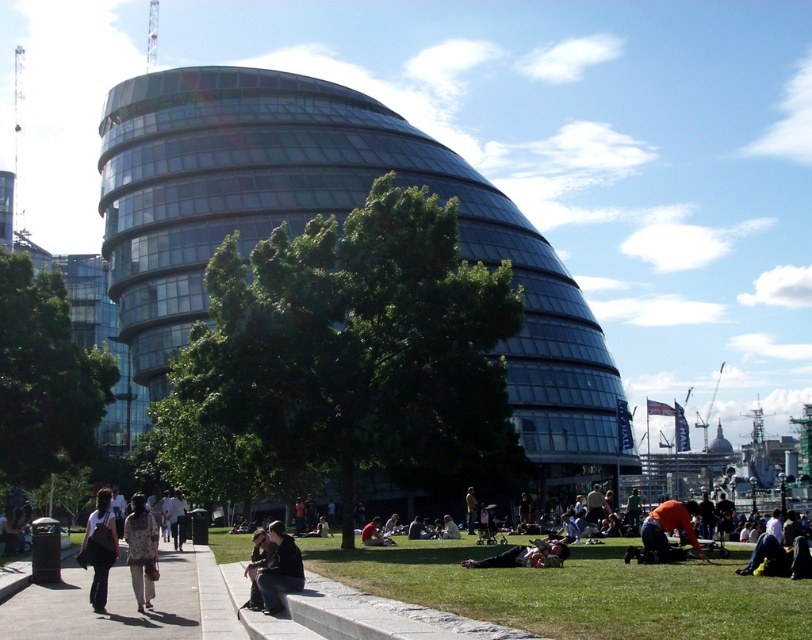
Question: Is concrete sidewalk at lower left above dark blue jeans at lower center?

Choices:
 (A) no
 (B) yes

Answer: (A)

Question: Which object appears closest to the camera in this image?

Choices:
 (A) dark gray fabric jacket at lower center
 (B) dark blue jeans at lower center
 (C) matte black jacket at lower left
 (D) dark brown leather jacket at lower center

Answer: (A)

Question: Can you confirm if concrete sidewalk at lower left is thinner than dark brown leather jacket at lower center?

Choices:
 (A) no
 (B) yes

Answer: (A)

Question: Is floral fabric dress at lower center closer to the viewer compared to orange fabric at lower right?

Choices:
 (A) no
 (B) yes

Answer: (B)

Question: Which of the following is the closest to the observer?

Choices:
 (A) (127, 531)
 (B) (508, 550)

Answer: (A)

Question: Which point is farther to the camera?

Choices:
 (A) (655, 540)
 (B) (148, 531)
 (C) (694, 572)
 (D) (374, 544)

Answer: (D)